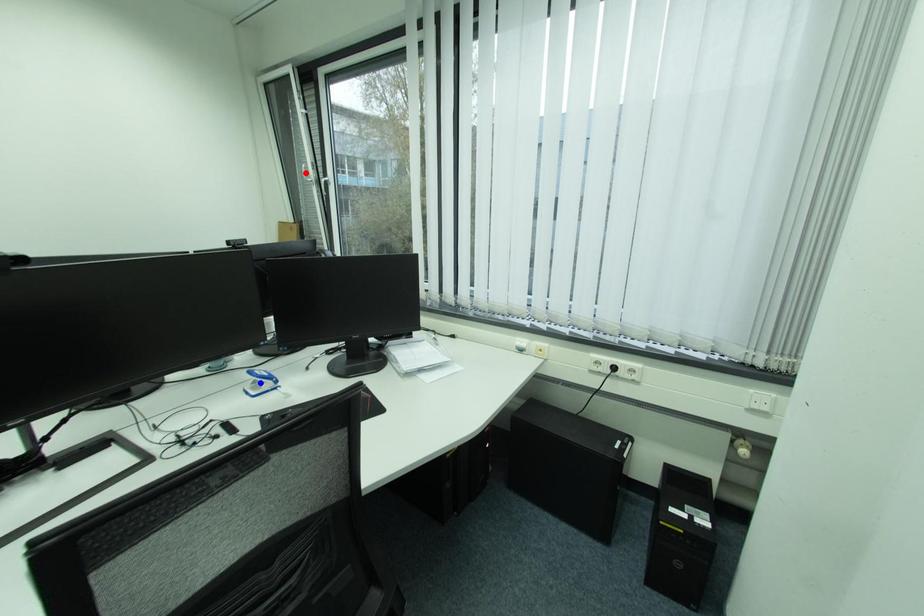
Question: Which of the two points in the image is closer to the camera?

Choices:
 (A) Blue point is closer.
 (B) Red point is closer.

Answer: (A)